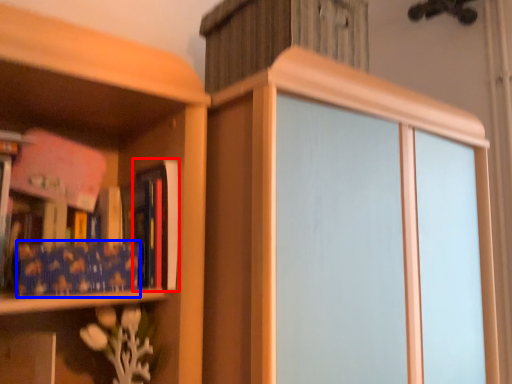
Question: Which object appears farthest to the camera in this image, book (highlighted by a red box) or paperback book (highlighted by a blue box)?

Choices:
 (A) book
 (B) paperback book

Answer: (A)